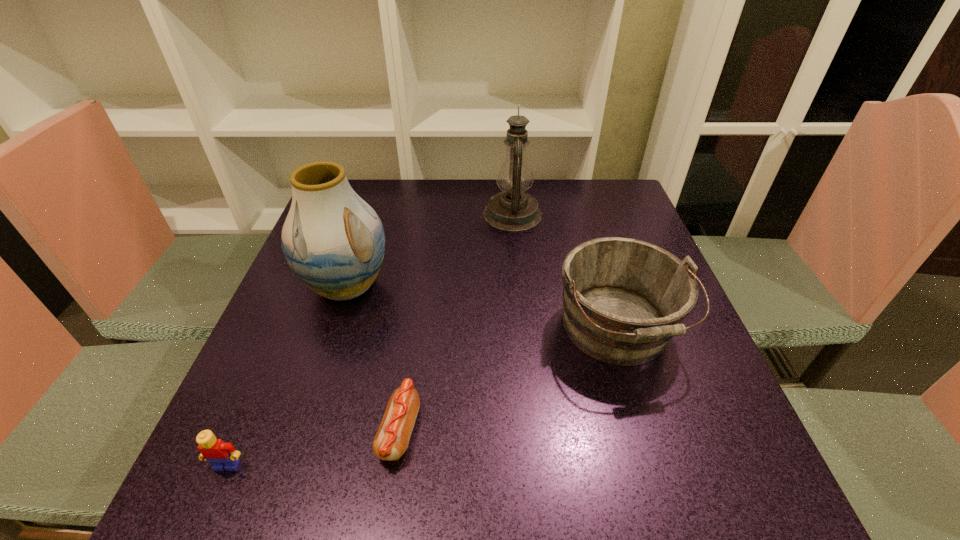
The height and width of the screenshot is (540, 960). I want to click on vacant space that's between the fourth tallest object and the wine bucket, so point(421,397).

Where is `free point between the second shortest object and the farthest object`? The width and height of the screenshot is (960, 540). free point between the second shortest object and the farthest object is located at coordinates (370, 340).

The image size is (960, 540). I want to click on unoccupied area between the wine bucket and the second shortest object, so click(x=421, y=397).

Locate an element on the screen. free area in between the second shortest object and the oil lamp is located at coordinates click(x=370, y=340).

You are a GUI agent. You are given a task and a screenshot of the screen. Output one action in this format:
    pyautogui.click(x=<x>, y=<y>)
    Task: Click on the free space between the third object from left to right and the Lego
    
    Given the screenshot: What is the action you would take?
    pyautogui.click(x=313, y=448)

At what (x,y) coordinates should I click in order to perform the action: click on the fourth closest object relative to the farthest object. Please return your answer as a coordinate pair (x, y). This screenshot has width=960, height=540. Looking at the image, I should click on (221, 455).

The height and width of the screenshot is (540, 960). I want to click on the second closest object to the vase, so click(513, 210).